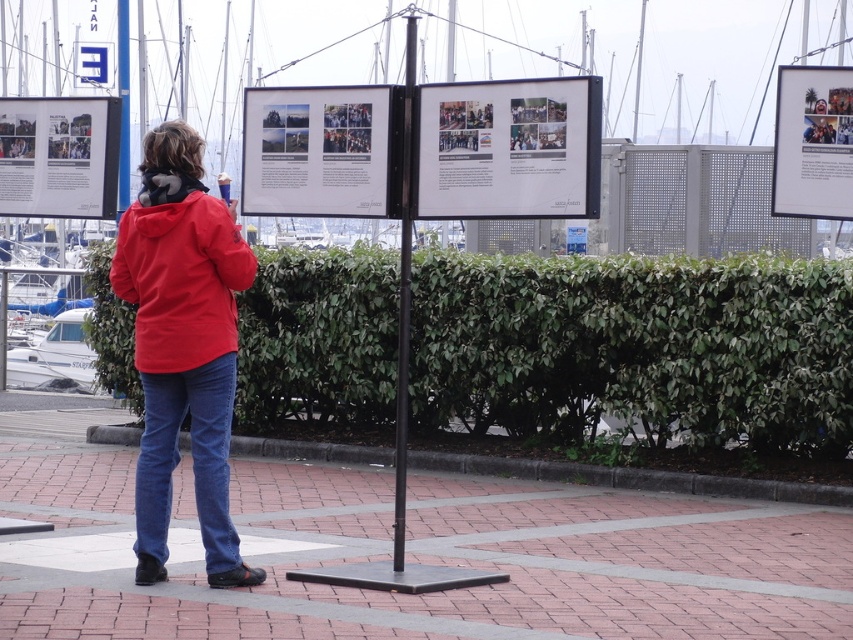
Question: Which point is farther to the camera?

Choices:
 (A) (405, 122)
 (B) (68, 342)
 (C) (189, 260)

Answer: (B)

Question: Considering the real-world distances, which object is farthest from the matte white poster at left?

Choices:
 (A) green leafy hedge at center
 (B) matte red jacket at center
 (C) matte white poster at center

Answer: (A)

Question: Is red fleece jacket at center positioned behind matte red jacket at center?

Choices:
 (A) no
 (B) yes

Answer: (A)

Question: Can you confirm if matte white poster at center is smaller than matte red jacket at center?

Choices:
 (A) no
 (B) yes

Answer: (B)

Question: Which object appears closest to the camera in this image?

Choices:
 (A) matte paper poster at center
 (B) red fleece jacket at center

Answer: (B)

Question: Is matte paper poster at center bigger than matte white poster at upper right?

Choices:
 (A) yes
 (B) no

Answer: (A)